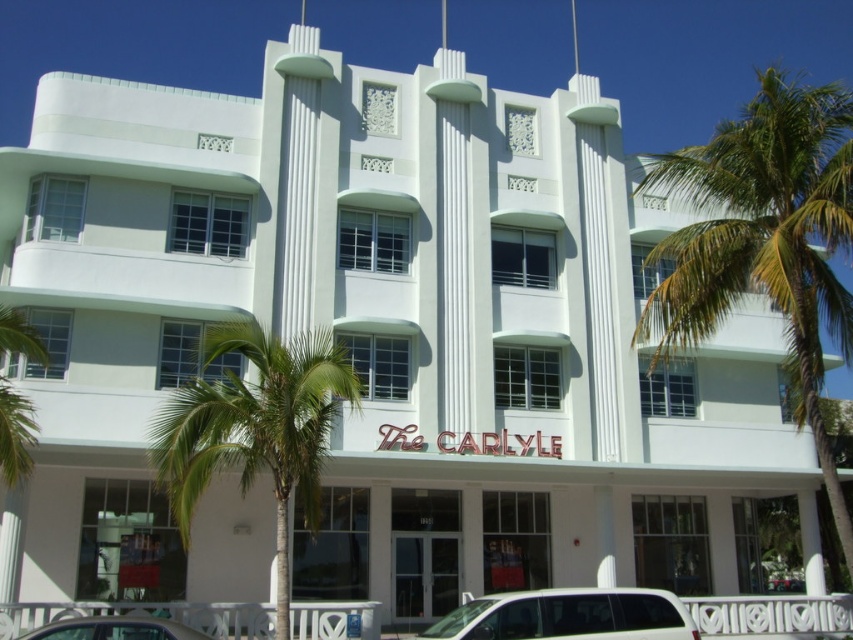
Is green leafy palm tree at right to the left of metallic silver car at lower left from the viewer's perspective?

No, green leafy palm tree at right is not to the left of metallic silver car at lower left.

Between point (727, 224) and point (129, 616), which one is positioned in front?

Positioned in front is point (129, 616).

Is point (814, 305) positioned before point (178, 637)?

No.

I want to click on green leafy palm tree at right, so (764, 241).

Based on the photo, can you confirm if green leafy palm tree at right is thinner than white glossy van at lower center?

Incorrect, green leafy palm tree at right's width is not less than white glossy van at lower center's.

Is green leafy palm tree at right to the right of white glossy van at lower center from the viewer's perspective?

Correct, you'll find green leafy palm tree at right to the right of white glossy van at lower center.

The height and width of the screenshot is (640, 853). What do you see at coordinates (764, 241) in the screenshot?
I see `green leafy palm tree at right` at bounding box center [764, 241].

Identify the location of green leafy palm tree at right. The height and width of the screenshot is (640, 853). (764, 241).

Can you confirm if green leafy palm tree at center is positioned to the right of white glossy van at lower center?

Incorrect, green leafy palm tree at center is not on the right side of white glossy van at lower center.

In the scene shown: Does green leafy palm tree at center have a greater height compared to white glossy van at lower center?

Incorrect, green leafy palm tree at center's height is not larger of white glossy van at lower center's.

Between point (299, 406) and point (444, 636), which one is positioned in front?

Positioned in front is point (444, 636).

At what (x,y) coordinates should I click in order to perform the action: click on green leafy palm tree at center. Please return your answer as a coordinate pair (x, y). Looking at the image, I should click on (254, 428).